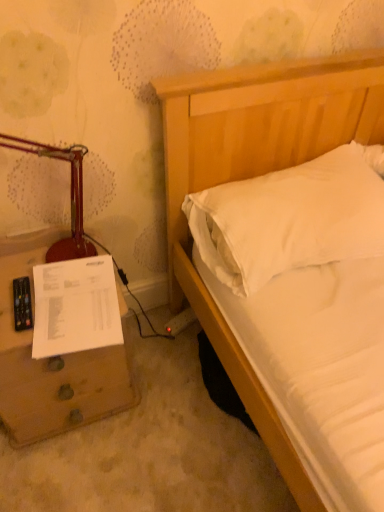
The image size is (384, 512). What do you see at coordinates (291, 218) in the screenshot? I see `white soft pillow at upper right` at bounding box center [291, 218].

Find the location of a particular element. This screenshot has width=384, height=512. brown wooden nightstand at lower left is located at coordinates (52, 364).

The height and width of the screenshot is (512, 384). What are the coordinates of `white paper at lower left` in the screenshot? It's located at (75, 307).

Locate an element on the screen. table lamp in front of the white paper at lower left is located at coordinates (70, 196).

Can you confirm if white paper at lower left is bigger than matte red table lamp at left?

No, white paper at lower left is not bigger than matte red table lamp at left.

Is white paper at lower left placed right next to matte red table lamp at left?

No, white paper at lower left is not in contact with matte red table lamp at left.

From the image's perspective, is white paper at lower left above or below matte red table lamp at left?

Clearly, from the image's perspective, white paper at lower left is below matte red table lamp at left.

From a real-world perspective, which object stands above the other?

From a 3D spatial view, matte red table lamp at left is above.

Can you confirm if matte red table lamp at left is wider than white paper at lower left?

No, matte red table lamp at left is not wider than white paper at lower left.

Which is more to the left, matte red table lamp at left or white paper at lower left?

From the viewer's perspective, matte red table lamp at left appears more on the left side.

How distant is matte red table lamp at left from white paper at lower left?

matte red table lamp at left is 6.82 inches away from white paper at lower left.

How much distance is there between brown wooden nightstand at lower left and white paper at lower left?

brown wooden nightstand at lower left and white paper at lower left are 5.50 inches apart.

In terms of size, does brown wooden nightstand at lower left appear bigger or smaller than white paper at lower left?

brown wooden nightstand at lower left is bigger than white paper at lower left.

In terms of width, does brown wooden nightstand at lower left look wider or thinner when compared to white paper at lower left?

brown wooden nightstand at lower left is wider than white paper at lower left.

Considering the relative sizes of brown wooden nightstand at lower left and white paper at lower left in the image provided, is brown wooden nightstand at lower left shorter than white paper at lower left?

No.

Is brown wooden nightstand at lower left outside of white soft pillow at upper right?

Yes.

Does point (95, 395) come behind point (265, 197)?

Yes, point (95, 395) is farther from viewer.

Considering the relative sizes of brown wooden nightstand at lower left and white soft pillow at upper right in the image provided, is brown wooden nightstand at lower left thinner than white soft pillow at upper right?

Yes, brown wooden nightstand at lower left is thinner than white soft pillow at upper right.

Does brown wooden nightstand at lower left lie behind matte red table lamp at left?

Yes, it is.

From the image's perspective, is brown wooden nightstand at lower left located above or below matte red table lamp at left?

Clearly, from the image's perspective, brown wooden nightstand at lower left is below matte red table lamp at left.

Which object is closer to the camera taking this photo, white soft pillow at upper right or brown wooden nightstand at lower left?

Positioned in front is brown wooden nightstand at lower left.

Could brown wooden nightstand at lower left be considered to be inside white soft pillow at upper right?

No, white soft pillow at upper right does not contain brown wooden nightstand at lower left.

Does white soft pillow at upper right appear on the right side of brown wooden nightstand at lower left?

Answer: Yes, white soft pillow at upper right is to the right of brown wooden nightstand at lower left.

Which is more to the left, white paper at lower left or white soft pillow at upper right?

white paper at lower left is more to the left.

Where is `pillow on the right of white paper at lower left`? The width and height of the screenshot is (384, 512). pillow on the right of white paper at lower left is located at coordinates (291, 218).

Looking at this image, considering the relative sizes of white paper at lower left and white soft pillow at upper right in the image provided, is white paper at lower left wider than white soft pillow at upper right?

Incorrect, the width of white paper at lower left does not surpass that of white soft pillow at upper right.

From the image's perspective, is white paper at lower left above white soft pillow at upper right?

No.

Locate an element on the screen. This screenshot has height=512, width=384. document lying below the matte red table lamp at left (from the image's perspective) is located at coordinates (75, 307).

Identify the location of document behind the matte red table lamp at left. (75, 307).

From the picture: Looking at the image, which one is located further to matte red table lamp at left, white soft pillow at upper right or white paper at lower left?

The object further to matte red table lamp at left is white soft pillow at upper right.

From the picture: Which object lies further to the anchor point white soft pillow at upper right, white paper at lower left or brown wooden nightstand at lower left?

brown wooden nightstand at lower left is further to white soft pillow at upper right.

Based on their spatial positions, is matte red table lamp at left or white soft pillow at upper right closer to brown wooden nightstand at lower left?

Among the two, matte red table lamp at left is located nearer to brown wooden nightstand at lower left.

Considering their positions, is white paper at lower left positioned closer to brown wooden nightstand at lower left than white soft pillow at upper right?

white paper at lower left is positioned closer to the anchor brown wooden nightstand at lower left.

When comparing their distances from white soft pillow at upper right, does white paper at lower left or matte red table lamp at left seem closer?

Based on the image, white paper at lower left appears to be nearer to white soft pillow at upper right.

When comparing their distances from matte red table lamp at left, does brown wooden nightstand at lower left or white soft pillow at upper right seem closer?

Among the two, brown wooden nightstand at lower left is located nearer to matte red table lamp at left.

Which object lies nearer to the anchor point white paper at lower left, matte red table lamp at left or white soft pillow at upper right?

Based on the image, matte red table lamp at left appears to be nearer to white paper at lower left.

When comparing their distances from brown wooden nightstand at lower left, does white paper at lower left or matte red table lamp at left seem closer?

The object closer to brown wooden nightstand at lower left is white paper at lower left.

Image resolution: width=384 pixels, height=512 pixels. I want to click on document between matte red table lamp at left and brown wooden nightstand at lower left from top to bottom, so click(x=75, y=307).

This screenshot has height=512, width=384. Identify the location of document between matte red table lamp at left and white soft pillow at upper right from left to right. (75, 307).

Locate an element on the screen. This screenshot has width=384, height=512. nightstand located between matte red table lamp at left and white soft pillow at upper right in the left-right direction is located at coordinates (52, 364).

Find the location of `document located between brown wooden nightstand at lower left and white soft pillow at upper right in the left-right direction`. document located between brown wooden nightstand at lower left and white soft pillow at upper right in the left-right direction is located at coordinates (75, 307).